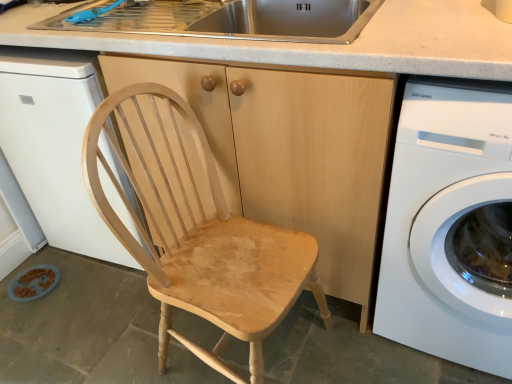
Locate an element on the screen. The width and height of the screenshot is (512, 384). white glossy washing machine at right is located at coordinates (450, 224).

Identify the location of light wood cabinet at center. This screenshot has width=512, height=384. (292, 152).

Identify the location of blue plastic faucet at upper left. Image resolution: width=512 pixels, height=384 pixels. [x=100, y=11].

Where is `white glossy washing machine at right`? The width and height of the screenshot is (512, 384). white glossy washing machine at right is located at coordinates (450, 224).

Where is `cabinetry above the white glossy washing machine at right (from the image's perspective)`? Image resolution: width=512 pixels, height=384 pixels. cabinetry above the white glossy washing machine at right (from the image's perspective) is located at coordinates (292, 152).

From a real-world perspective, is white glossy washing machine at right physically above light wood cabinet at center?

No, from a real-world perspective, white glossy washing machine at right is not above light wood cabinet at center.

Is white glossy washing machine at right oriented towards light wood cabinet at center?

No, white glossy washing machine at right is not aimed at light wood cabinet at center.

From a real-world perspective, relative to stainless steel sink at upper center, is light wood cabinet at center vertically above or below?

From a real-world perspective, light wood cabinet at center is physically below stainless steel sink at upper center.

The width and height of the screenshot is (512, 384). In order to click on sink lying above the light wood cabinet at center (from the image's perspective) in this screenshot , I will do `click(226, 19)`.

Is light wood cabinet at center not inside stainless steel sink at upper center?

Yes, light wood cabinet at center is outside of stainless steel sink at upper center.

Does point (283, 86) lie behind point (182, 24)?

No, it is in front of (182, 24).

Is point (459, 359) closer to camera compared to point (257, 35)?

That is True.

From the image's perspective, between white glossy washing machine at right and stainless steel sink at upper center, who is located below?

white glossy washing machine at right.

From a real-world perspective, is white glossy washing machine at right on top of stainless steel sink at upper center?

Incorrect, from a real-world perspective, white glossy washing machine at right is lower than stainless steel sink at upper center.

Based on the photo, is white glossy washing machine at right spatially inside stainless steel sink at upper center, or outside of it?

white glossy washing machine at right is located beyond the bounds of stainless steel sink at upper center.

Which object is wider, blue plastic faucet at upper left or light wood cabinet at center?

Wider between the two is light wood cabinet at center.

Is blue plastic faucet at upper left outside of light wood cabinet at center?

Yes.

Is blue plastic faucet at upper left oriented away from light wood cabinet at center?

That's not correct — blue plastic faucet at upper left is not looking away from light wood cabinet at center.

Is blue plastic faucet at upper left at the left side of light wood cabinet at center?

Yes.

Looking at this image, considering the relative sizes of stainless steel sink at upper center and white glossy washing machine at right in the image provided, is stainless steel sink at upper center thinner than white glossy washing machine at right?

Indeed, stainless steel sink at upper center has a lesser width compared to white glossy washing machine at right.

Is stainless steel sink at upper center facing away from white glossy washing machine at right?

No, stainless steel sink at upper center is not facing the opposite direction of white glossy washing machine at right.

Looking at the image, does stainless steel sink at upper center seem bigger or smaller compared to white glossy washing machine at right?

Clearly, stainless steel sink at upper center is smaller in size than white glossy washing machine at right.

Can you confirm if white glossy washing machine at right is smaller than white glossy dishwasher at left?

Yes, white glossy washing machine at right is smaller than white glossy dishwasher at left.

From a real-world perspective, is white glossy washing machine at right positioned over white glossy dishwasher at left based on gravity?

No, from a real-world perspective, white glossy washing machine at right is not on top of white glossy dishwasher at left.

Can you confirm if white glossy washing machine at right is shorter than white glossy dishwasher at left?

Correct, white glossy washing machine at right is not as tall as white glossy dishwasher at left.

Is point (430, 329) closer or farther from the camera than point (53, 92)?

Clearly, point (430, 329) is closer to the camera than point (53, 92).

Is light wood cabinet at center at the right side of white glossy washing machine at right?

In fact, light wood cabinet at center is to the left of white glossy washing machine at right.

Is light wood cabinet at center directly adjacent to white glossy washing machine at right?

No, light wood cabinet at center is not in contact with white glossy washing machine at right.

From the picture: Does light wood cabinet at center have a larger size compared to white glossy washing machine at right?

Yes, light wood cabinet at center is bigger than white glossy washing machine at right.

Image resolution: width=512 pixels, height=384 pixels. I want to click on washing machine below the light wood cabinet at center (from a real-world perspective), so click(450, 224).

I want to click on sink on the left of light wood cabinet at center, so click(226, 19).

Considering their positions, is light wood cabinet at center positioned closer to white glossy dishwasher at left than stainless steel sink at upper center?

Based on the image, stainless steel sink at upper center appears to be nearer to white glossy dishwasher at left.

From the image, which object appears to be nearer to light wood cabinet at center, stainless steel sink at upper center or white glossy dishwasher at left?

stainless steel sink at upper center.

Based on their spatial positions, is stainless steel sink at upper center or white glossy washing machine at right closer to blue plastic faucet at upper left?

stainless steel sink at upper center lies closer to blue plastic faucet at upper left than the other object.

Based on their spatial positions, is stainless steel sink at upper center or white glossy dishwasher at left further from blue plastic faucet at upper left?

white glossy dishwasher at left is further to blue plastic faucet at upper left.

When comparing their distances from stainless steel sink at upper center, does white glossy washing machine at right or blue plastic faucet at upper left seem further?

white glossy washing machine at right is further to stainless steel sink at upper center.

Looking at the image, which one is located further to stainless steel sink at upper center, white glossy washing machine at right or light wood cabinet at center?

white glossy washing machine at right is positioned further to the anchor stainless steel sink at upper center.

Considering their positions, is light wood cabinet at center positioned further to blue plastic faucet at upper left than white glossy washing machine at right?

Based on the image, white glossy washing machine at right appears to be further to blue plastic faucet at upper left.

Estimate the real-world distances between objects in this image. Which object is closer to stainless steel sink at upper center, white glossy dishwasher at left or light wood cabinet at center?

Among the two, light wood cabinet at center is located nearer to stainless steel sink at upper center.

Where is `cabinetry between blue plastic faucet at upper left and white glossy washing machine at right in the horizontal direction`? cabinetry between blue plastic faucet at upper left and white glossy washing machine at right in the horizontal direction is located at coordinates (292, 152).

Identify the location of faucet between white glossy dishwasher at left and light wood cabinet at center. This screenshot has width=512, height=384. (100, 11).

I want to click on cabinetry between white glossy dishwasher at left and white glossy washing machine at right from left to right, so click(x=292, y=152).

I want to click on sink between blue plastic faucet at upper left and white glossy dishwasher at left in the vertical direction, so click(226, 19).